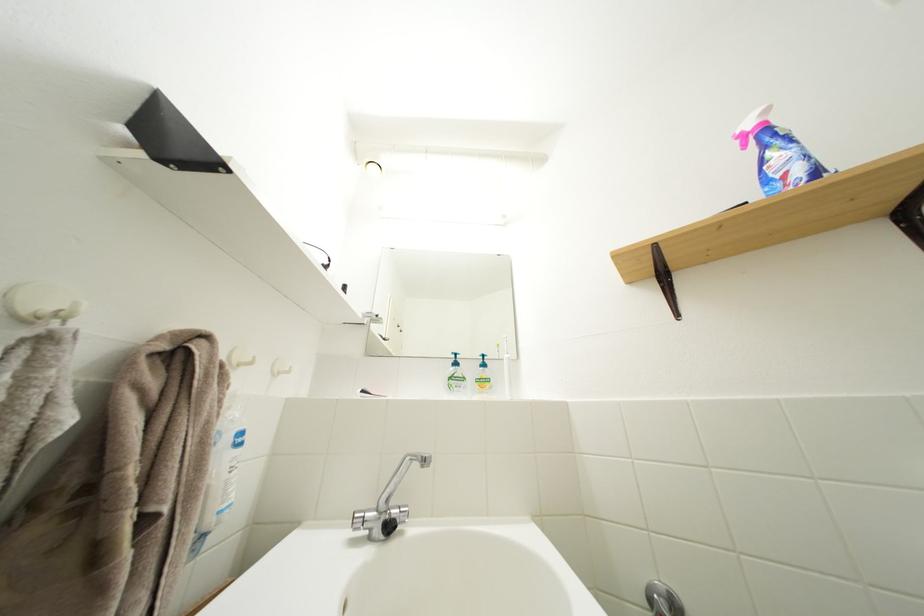
Describe the element at coordinates (482, 377) in the screenshot. I see `a yellow soap pump` at that location.